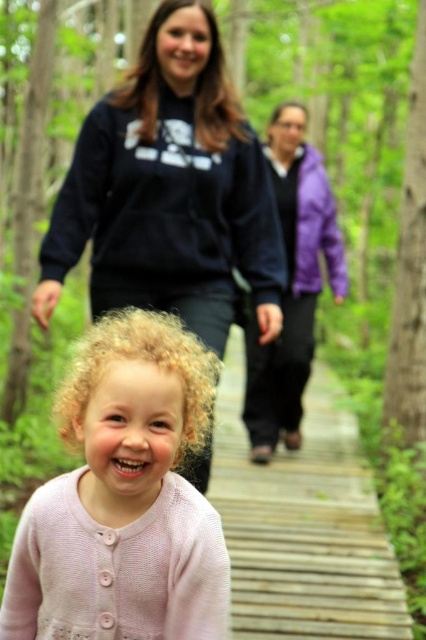
Between dark blue fleece sweatshirt at upper center and purple matte sweatshirt at upper center, which one is positioned higher?

Positioned higher is purple matte sweatshirt at upper center.

Between dark blue fleece sweatshirt at upper center and purple matte sweatshirt at upper center, which one has more height?

Standing taller between the two is purple matte sweatshirt at upper center.

Which is in front, point (104, 268) or point (305, 276)?

Point (104, 268) is in front.

I want to click on dark blue fleece sweatshirt at upper center, so click(164, 209).

Is pink knitted sweater at center to the right of purple matte sweatshirt at upper center from the viewer's perspective?

In fact, pink knitted sweater at center is to the left of purple matte sweatshirt at upper center.

Measure the distance between pink knitted sweater at center and camera.

They are 4.15 feet apart.

This screenshot has width=426, height=640. Find the location of `pink knitted sweater at center`. pink knitted sweater at center is located at coordinates (124, 497).

The image size is (426, 640). Describe the element at coordinates (124, 497) in the screenshot. I see `pink knitted sweater at center` at that location.

The image size is (426, 640). Find the location of `pink knitted sweater at center`. pink knitted sweater at center is located at coordinates (124, 497).